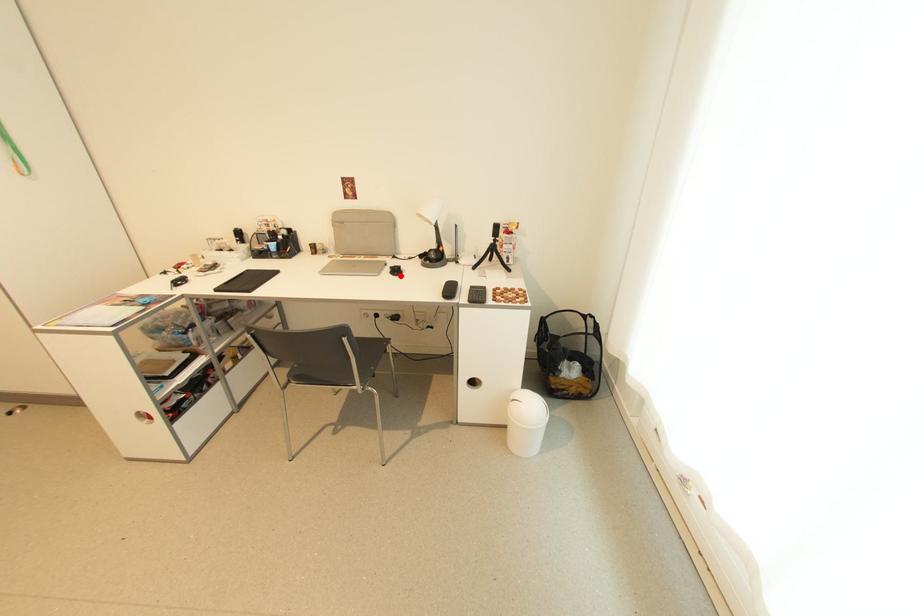
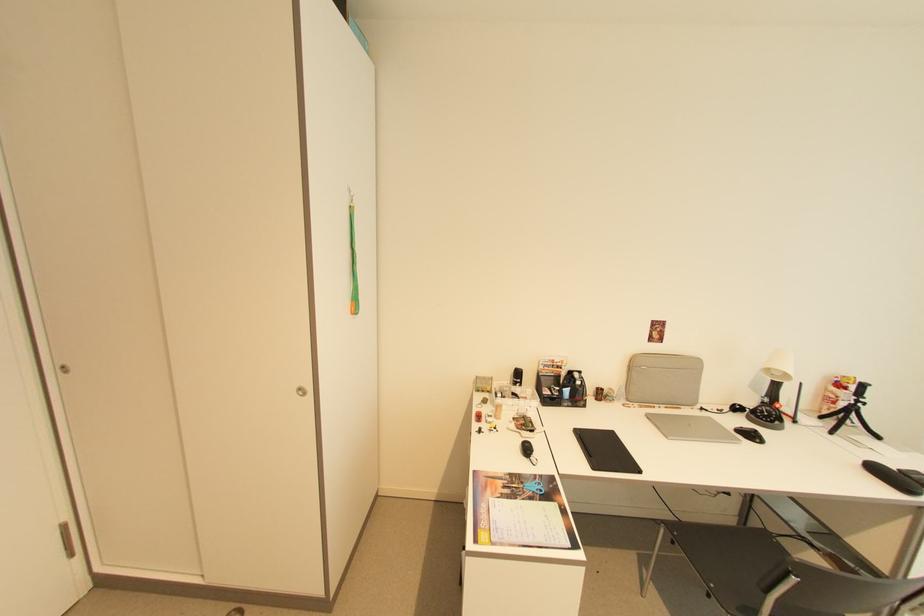
Find the pixel in the second image that matches the highlighted location in the first image.

(762, 442)